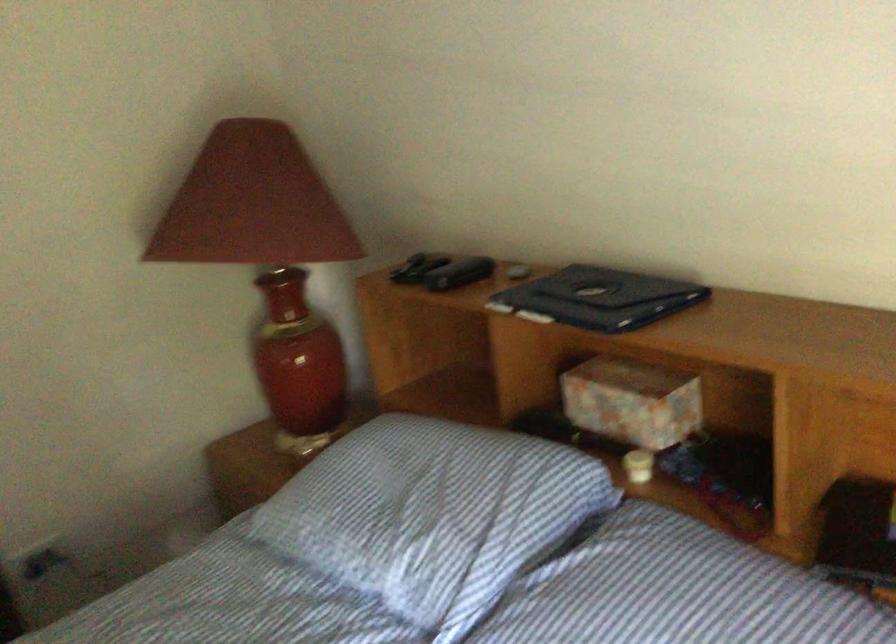
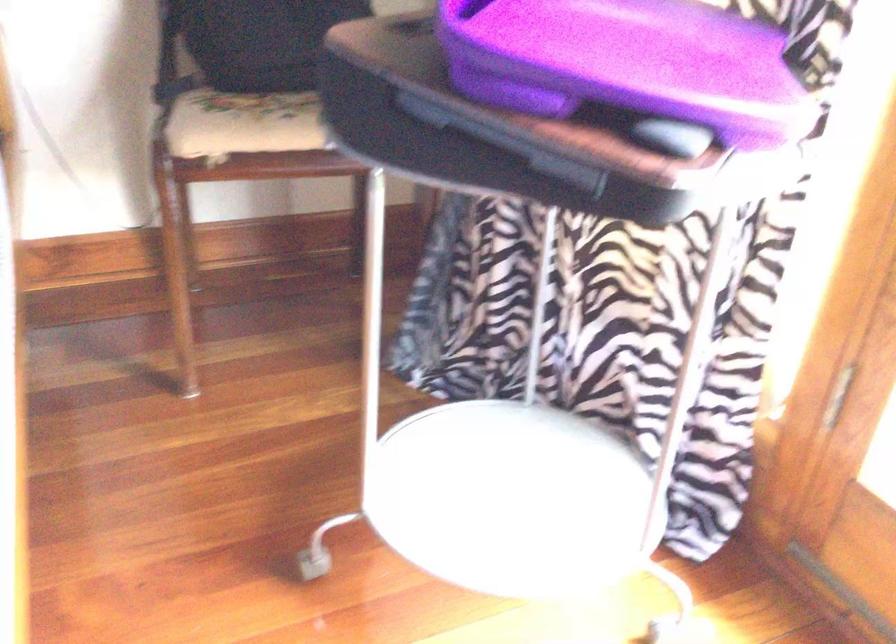
Question: The camera is either moving clockwise (left) or counter-clockwise (right) around the object. The first image is from the beginning of the video and the second image is from the end. Is the camera moving left or right when shooting the video?

Choices:
 (A) Left
 (B) Right

Answer: (A)